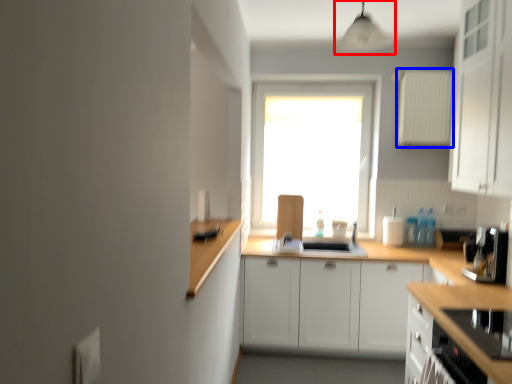
Question: Which object appears farthest to the camera in this image, light fixture (highlighted by a red box) or appliance (highlighted by a blue box)?

Choices:
 (A) light fixture
 (B) appliance

Answer: (B)